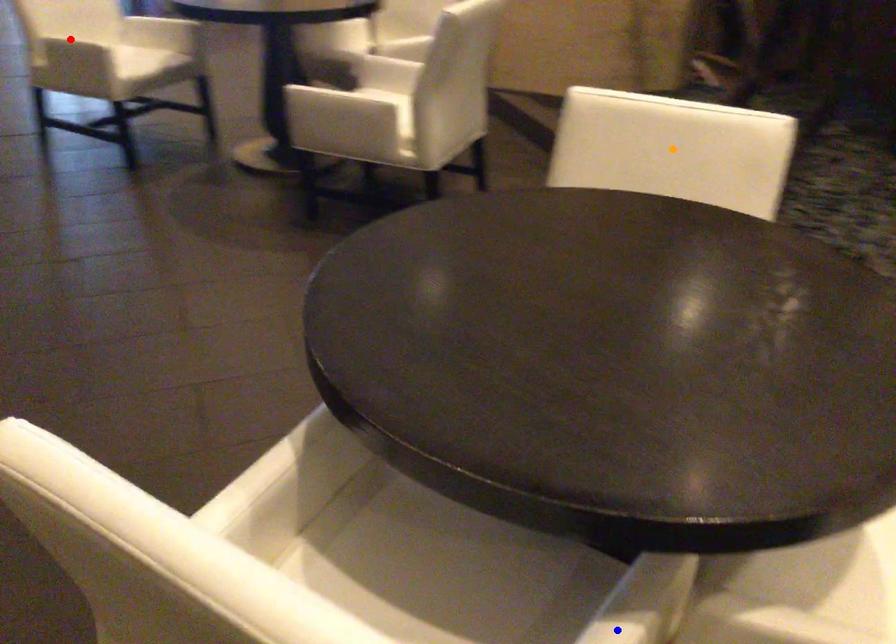
Order these from farthest to nearest:
1. blue point
2. orange point
3. red point

red point → orange point → blue point